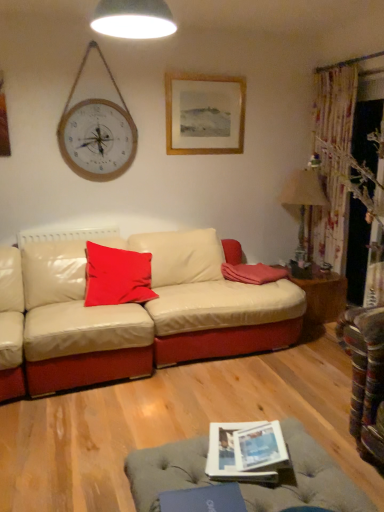
Locate an element on the screen. The width and height of the screenshot is (384, 512). blank area beneath white glossy lampshade at upper center, placed as the 2th lamp when sorted from right to left (from a real-world perspective) is located at coordinates (155, 411).